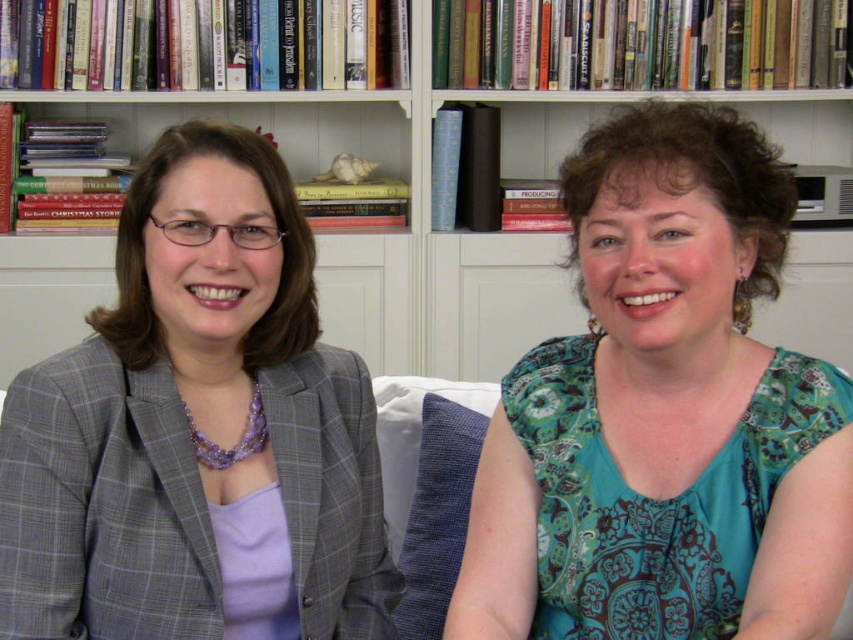
Question: Which point is closer to the camera?

Choices:
 (A) gray checkered blazer at left
 (B) teal paisley blouse at center

Answer: (B)

Question: Can you confirm if teal paisley blouse at center is positioned to the right of gray checkered blazer at left?

Choices:
 (A) yes
 (B) no

Answer: (A)

Question: Based on their relative distances, which object is farther from the gray checkered blazer at left?

Choices:
 (A) teal paisley blouse at center
 (B) wooden bookshelf at upper center

Answer: (B)

Question: Is teal paisley blouse at center in front of gray checkered blazer at left?

Choices:
 (A) yes
 (B) no

Answer: (A)

Question: Among these points, which one is nearest to the camera?

Choices:
 (A) (477, 285)
 (B) (279, 282)

Answer: (B)

Question: Is gray checkered blazer at left positioned in front of wooden bookshelf at upper center?

Choices:
 (A) no
 (B) yes

Answer: (B)